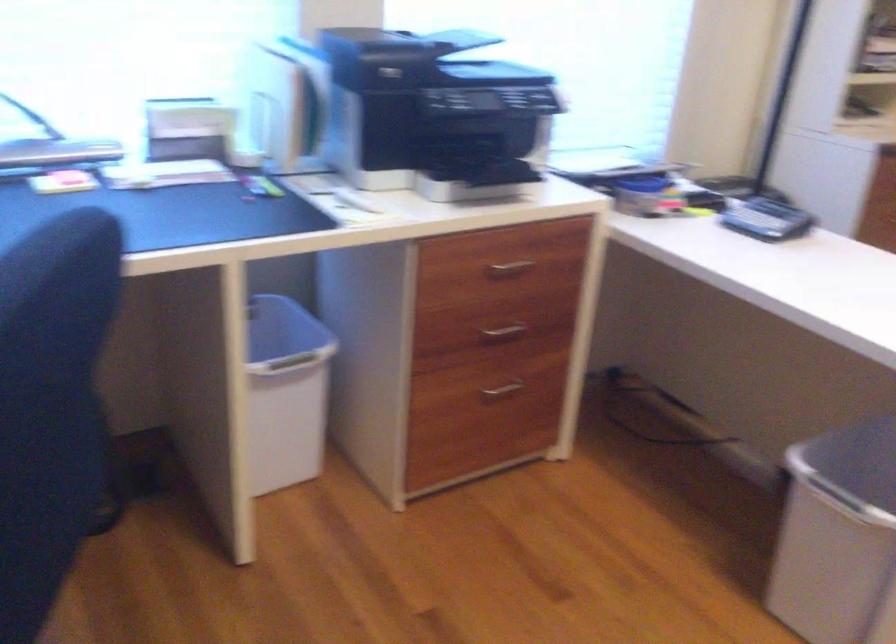
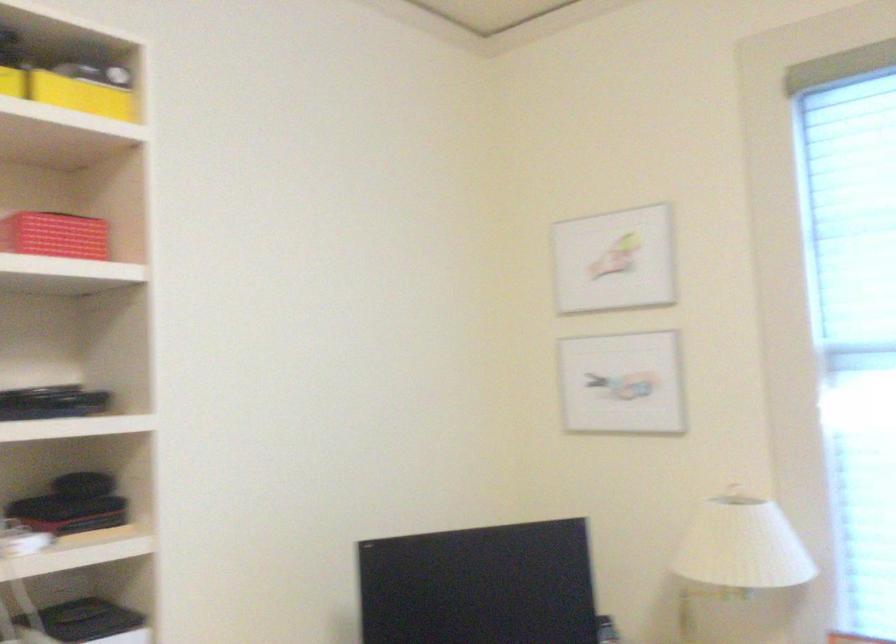
The images are taken continuously from a first-person perspective. In which direction is your viewpoint rotating?

The camera rotated toward left-up.